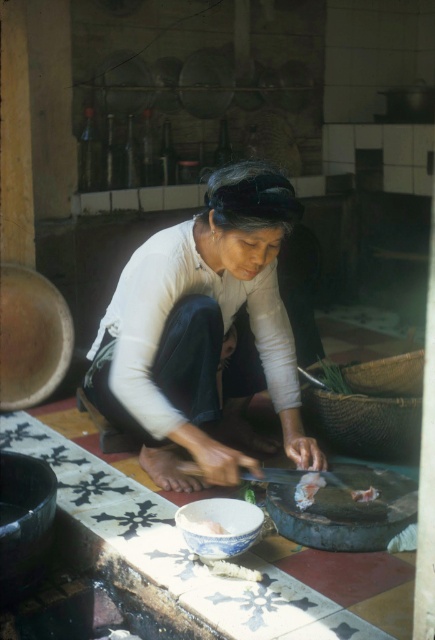
Question: Does white matte fabric at center appear over white soft food at center?

Choices:
 (A) no
 (B) yes

Answer: (B)

Question: Considering the real-world distances, which object is farthest from the blue porcelain bowl at lower center?

Choices:
 (A) white matte fabric at center
 (B) white soft food at center
 (C) white glossy meat at center

Answer: (A)

Question: Estimate the real-world distances between objects in this image. Which object is farther from the white glossy meat at center?

Choices:
 (A) blue porcelain bowl at lower center
 (B) white soft food at center

Answer: (A)

Question: Is white matte fabric at center positioned at the back of blue porcelain bowl at lower center?

Choices:
 (A) yes
 (B) no

Answer: (A)

Question: Is white matte fabric at center behind white soft food at center?

Choices:
 (A) no
 (B) yes

Answer: (A)

Question: Which object is farther from the camera taking this photo?

Choices:
 (A) white glossy meat at center
 (B) white soft food at center
 (C) white matte fabric at center
 (D) blue porcelain bowl at lower center

Answer: (A)